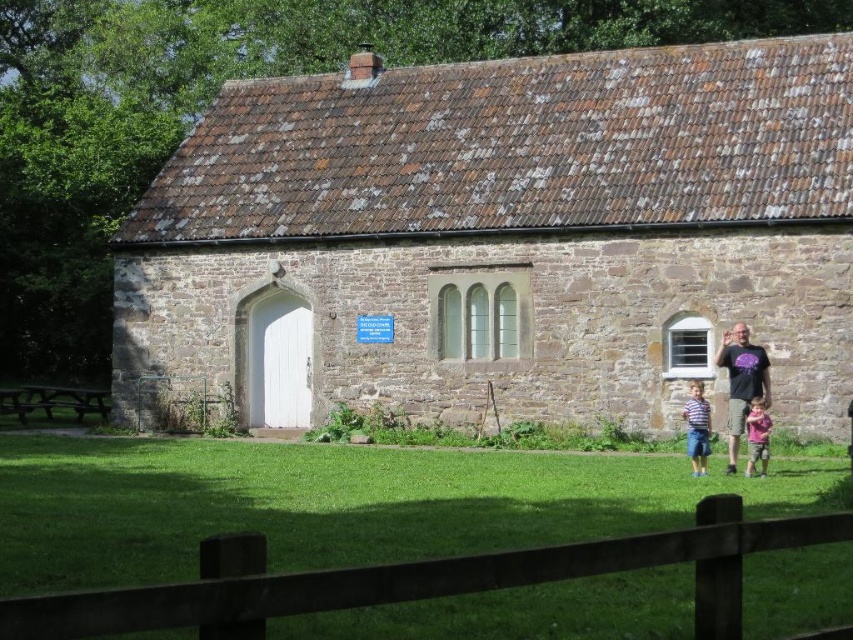
Does point (253, 570) come farther from viewer compared to point (698, 432)?

No, (253, 570) is closer to viewer.

Is brown wooden fence at lower center closer to camera compared to striped cotton shirt at lower right?

Yes, it is in front of striped cotton shirt at lower right.

Does point (646, 564) lie behind point (691, 429)?

No, it is not.

This screenshot has width=853, height=640. Find the location of `brown wooden fence at lower center`. brown wooden fence at lower center is located at coordinates (419, 579).

Can you confirm if brown wooden fence at lower center is wider than pink cotton shirt at lower right?

Indeed, brown wooden fence at lower center has a greater width compared to pink cotton shirt at lower right.

Which is behind, point (28, 636) or point (757, 413)?

The point (757, 413) is behind.

Between point (700, 618) and point (750, 403), which one is positioned in front?

Point (700, 618)

Where is `brown wooden fence at lower center`? Image resolution: width=853 pixels, height=640 pixels. brown wooden fence at lower center is located at coordinates (419, 579).

Does brown stone church at center lie behind brown wooden fence at lower center?

Yes.

Is brown stone church at center below brown wooden fence at lower center?

No.

Locate an element on the screen. The image size is (853, 640). brown stone church at center is located at coordinates 502,237.